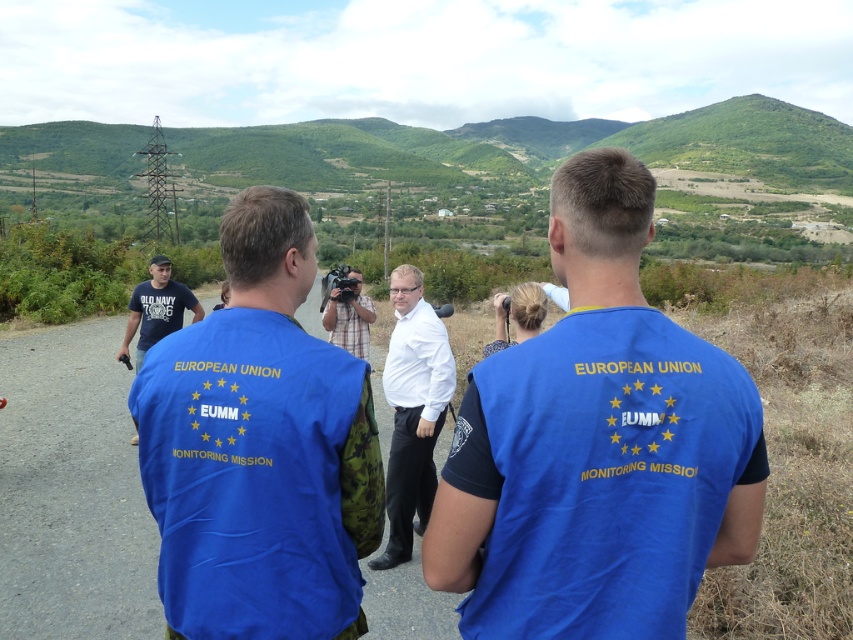
Is blue fabric shirt at center below dark blue t-shirt at left?

Incorrect, blue fabric shirt at center is not positioned below dark blue t-shirt at left.

Does blue fabric shirt at center appear over dark blue t-shirt at left?

Yes.

Identify the location of blue fabric shirt at center. (596, 445).

Identify the location of blue fabric shirt at center. pyautogui.click(x=596, y=445).

What are the coordinates of `blue fabric shirt at center` in the screenshot? It's located at (596, 445).

Is point (509, 525) in front of point (390, 392)?

Yes, it is in front of point (390, 392).

Locate an element on the screen. This screenshot has height=640, width=853. blue fabric shirt at center is located at coordinates (596, 445).

Measure the distance between point (268, 396) and camera.

Point (268, 396) and camera are 1.89 meters apart.

Is blue fabric vest at center shorter than plaid shirt at center?

No.

Is point (215, 355) less distant than point (358, 355)?

That is True.

Where is `blue fabric vest at center`? The image size is (853, 640). blue fabric vest at center is located at coordinates (259, 449).